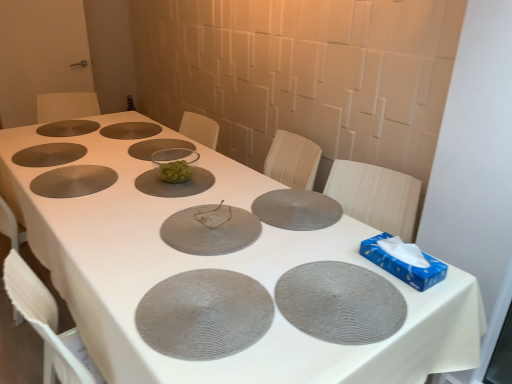
The width and height of the screenshot is (512, 384). I want to click on vacant area situated below gray textured placemat at center, positioned as the 10th glass plate in back-to-front order (from a real-world perspective), so click(208, 310).